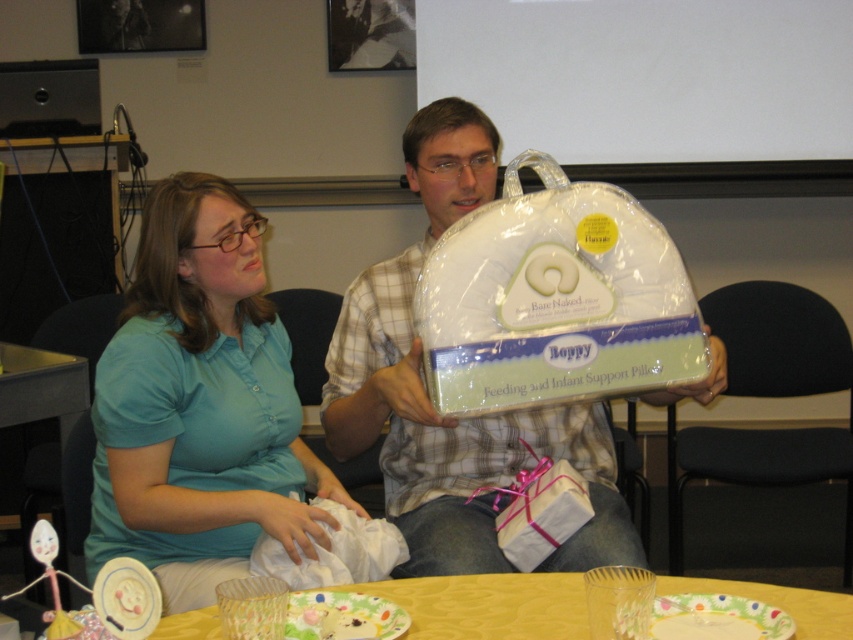
You are a photographer setting up for a portrait session in this indoor scene. You need to ensure that the teal fabric shirt at center and the matte white pillow at center are both visible in the frame. Based on their positions, which object is closer to the camera?

The teal fabric shirt at center is positioned under the matte white pillow at center, meaning the pillow is closer to the camera. Therefore, the matte white pillow at center is the one closer to the camera.

You are designing a new seating arrangement for a classroom. You have a teal fabric shirt at center and a yellow fabric table at lower center in the image. Which object should you consider for adjusting the seating space to accommodate size differences?

The teal fabric shirt at center has a larger size compared to the yellow fabric table at lower center. Therefore, you should adjust the seating space to accommodate the larger size of the teal fabric shirt at center.